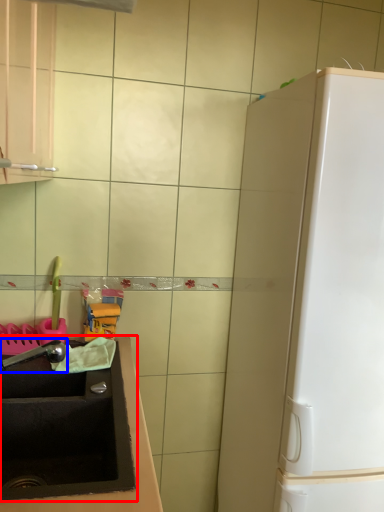
Question: Which object appears farthest to the camera in this image, sink (highlighted by a red box) or faucet (highlighted by a blue box)?

Choices:
 (A) sink
 (B) faucet

Answer: (B)